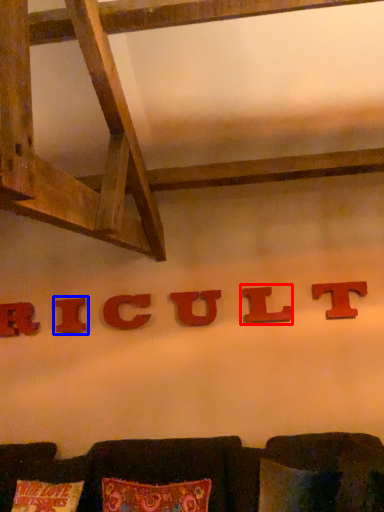
Question: Which object is further to the camera taking this photo, alphabet (highlighted by a red box) or alphabet (highlighted by a blue box)?

Choices:
 (A) alphabet
 (B) alphabet

Answer: (B)